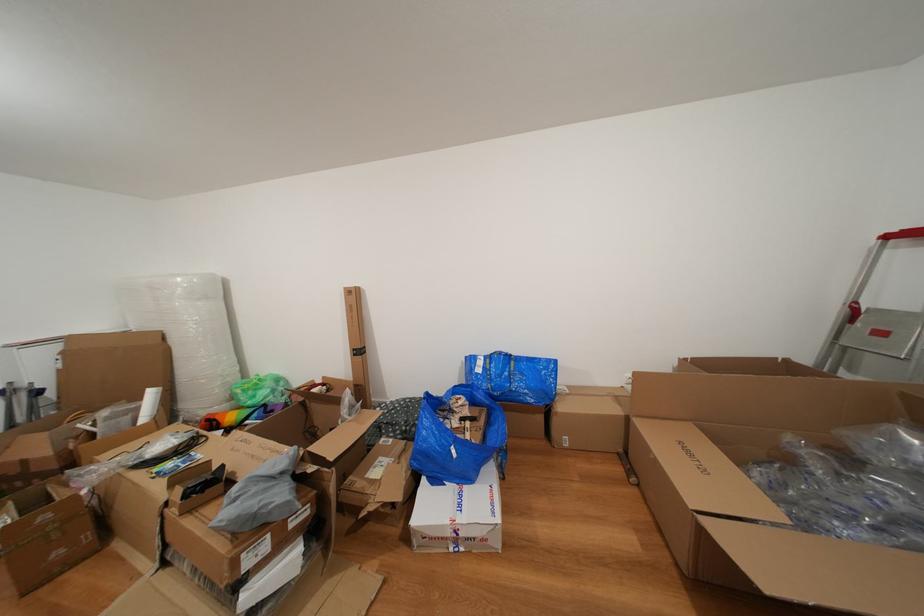
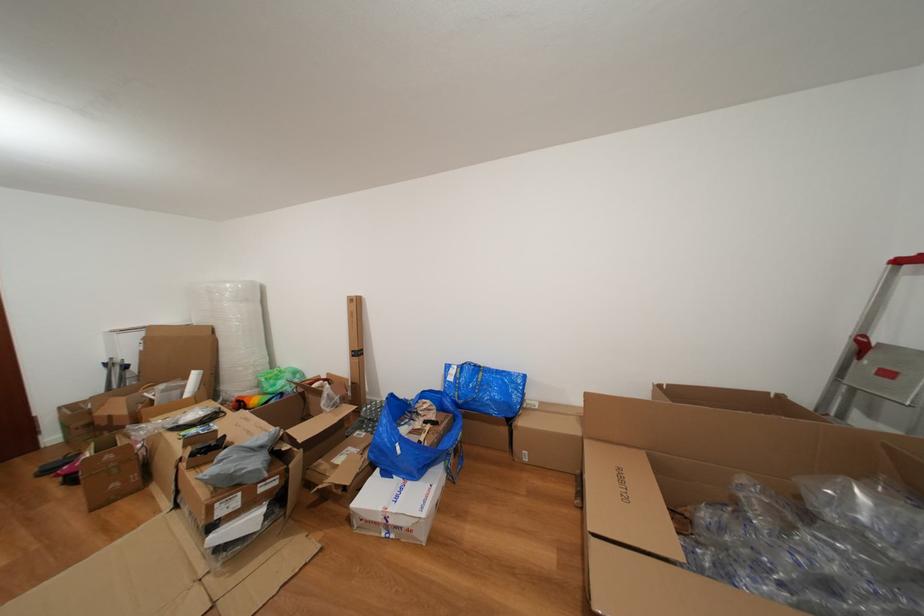
Locate, in the second image, the point that corresponds to the point at 796,443 in the first image.

(750, 485)